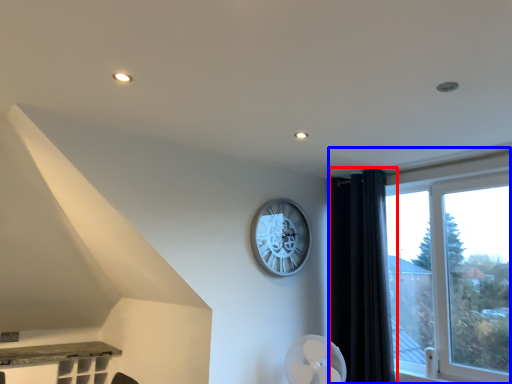
Question: Which object appears farthest to the camera in this image, curtain (highlighted by a red box) or window (highlighted by a blue box)?

Choices:
 (A) curtain
 (B) window

Answer: (A)